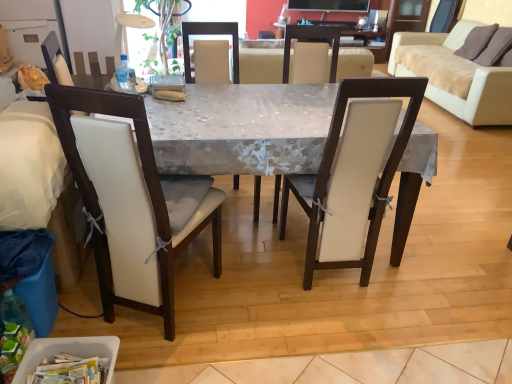
You are a GUI agent. You are given a task and a screenshot of the screen. Output one action in this format:
    pyautogui.click(x=<x>, y=<y>)
    Task: Click on the free space in front of white leather chair at center, acting as the fourth chair starting from the left
    The width and height of the screenshot is (512, 384).
    Given the screenshot: What is the action you would take?
    333,335